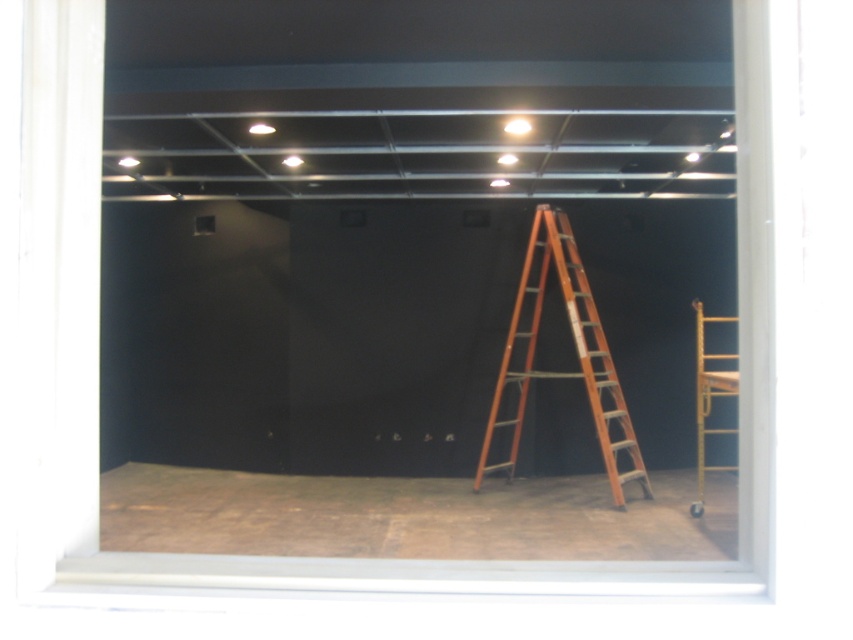
From the picture: You are standing in the center of the room and want to reach the unfinished floor area. Which direction should you move to get to the brown wood floor at lower center represented by point (412, 515)?

The brown wood floor at lower center is located at point (412, 515), so you should move downward from your current position in the center to reach it.

You are a worker in the construction site. You need to move a tool from the brown wood floor at lower center to the wooden ladder at center. Which direction should you move the tool to place it on the ladder?

The brown wood floor at lower center is in front of the wooden ladder at center, so you should move the tool backward to place it on the wooden ladder at center.